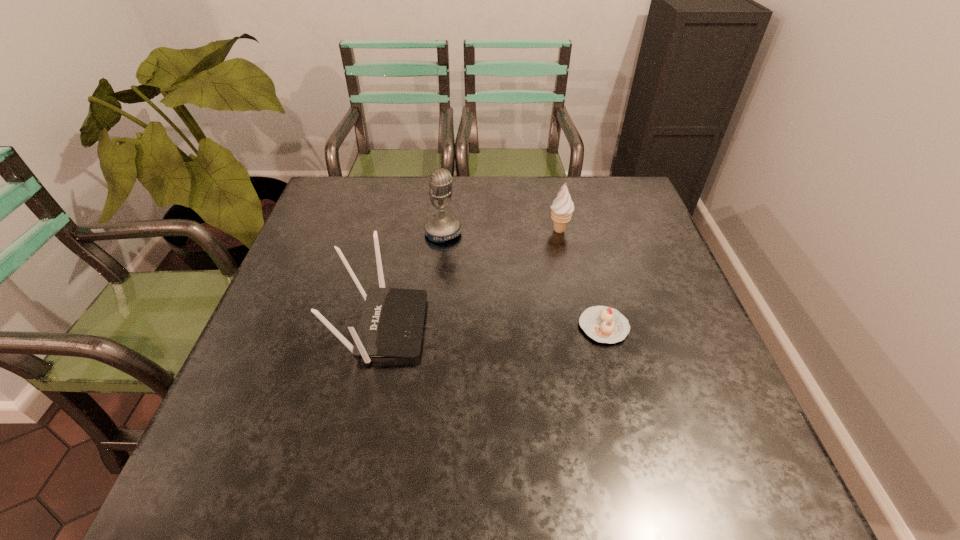
This screenshot has height=540, width=960. In order to click on free space between the shortest object and the router in this screenshot , I will do pos(493,327).

Locate an element on the screen. The image size is (960, 540). vacant area that lies between the shortest object and the microphone is located at coordinates (523, 280).

Locate an element on the screen. free point between the cupcake and the microphone is located at coordinates (523, 280).

You are a GUI agent. You are given a task and a screenshot of the screen. Output one action in this format:
    pyautogui.click(x=<x>, y=<y>)
    Task: Click on the free point between the router and the tallest object
    The height and width of the screenshot is (540, 960).
    Given the screenshot: What is the action you would take?
    pyautogui.click(x=413, y=280)

The width and height of the screenshot is (960, 540). Identify the location of empty space between the microphone and the router. (413, 280).

Find the location of a particular element. vacant area that lies between the icecream and the tallest object is located at coordinates (501, 232).

The width and height of the screenshot is (960, 540). I want to click on free area in between the router and the shortest object, so click(x=493, y=327).

This screenshot has width=960, height=540. What are the coordinates of `free space that is in between the icecream and the microphone` in the screenshot? It's located at (501, 232).

Choose which object is the third nearest neighbor to the router. Please provide its 2D coordinates. Your answer should be formatted as a tuple, i.e. [(x, y)], where the tuple contains the x and y coordinates of a point satisfying the conditions above.

[(562, 208)]

Where is `object that ranks as the third closest to the router`? This screenshot has width=960, height=540. object that ranks as the third closest to the router is located at coordinates (562, 208).